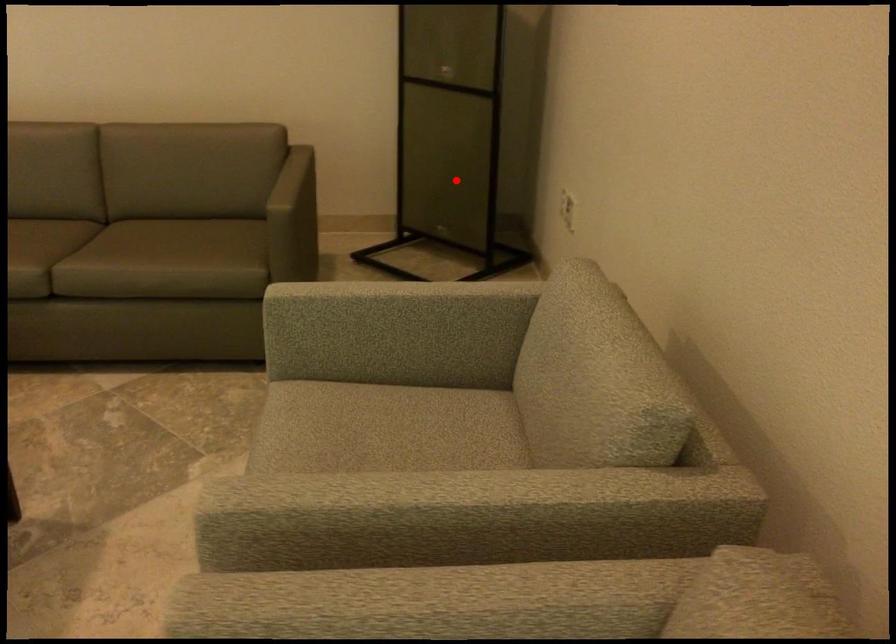
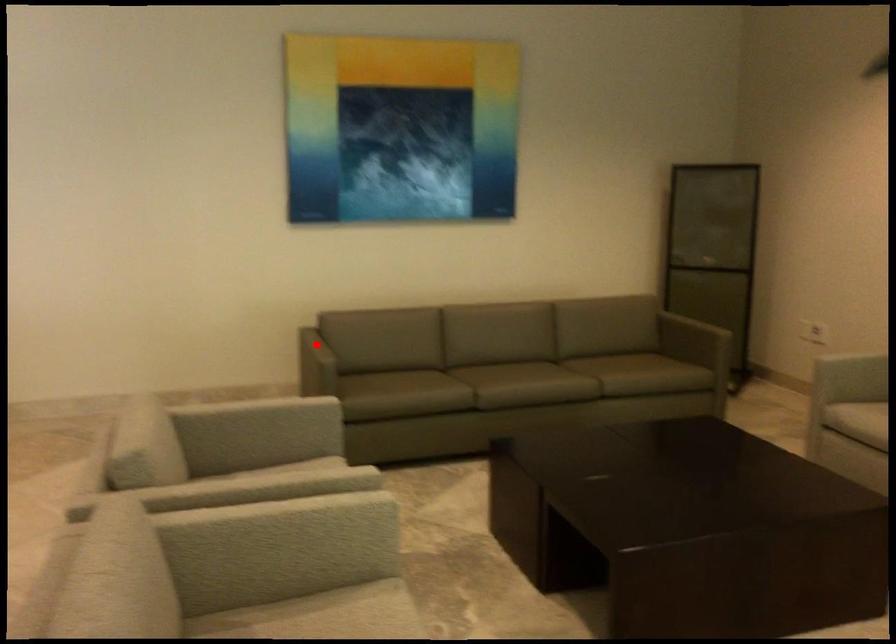
I am providing you with two images of the same scene from different viewpoints. A red point is marked on the first image and another point is marked on the second image. Is the marked point in image1 the same physical position as the marked point in image2?

No